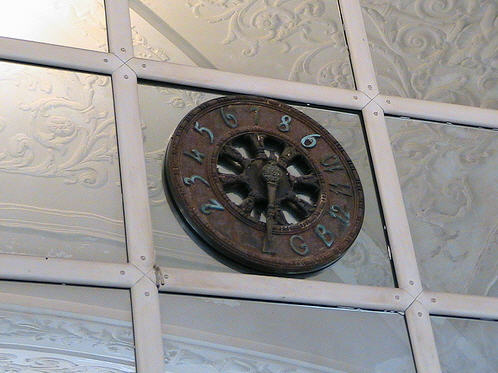
This screenshot has height=373, width=498. In order to click on light source in this screenshot , I will do `click(9, 13)`.